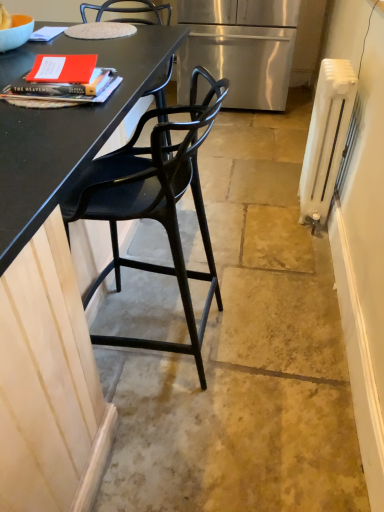
What is the approximate width of white painted metal radiator at right?

6.38 inches.

The width and height of the screenshot is (384, 512). Find the location of `stainless steel refrigerator at center`. stainless steel refrigerator at center is located at coordinates (240, 49).

Considering the positions of objects white painted metal radiator at right and stainless steel refrigerator at center in the image provided, who is behind, white painted metal radiator at right or stainless steel refrigerator at center?

stainless steel refrigerator at center is further from the camera.

In terms of size, does white painted metal radiator at right appear bigger or smaller than stainless steel refrigerator at center?

In the image, white painted metal radiator at right appears to be smaller than stainless steel refrigerator at center.

Is white painted metal radiator at right oriented towards stainless steel refrigerator at center?

No, white painted metal radiator at right is not aimed at stainless steel refrigerator at center.

Which is more to the right, black matte chair at left or stainless steel refrigerator at center?

stainless steel refrigerator at center.

Which of these two, black matte chair at left or stainless steel refrigerator at center, is smaller?

black matte chair at left is smaller.

From the image's perspective, which one is positioned higher, black matte chair at left or stainless steel refrigerator at center?

stainless steel refrigerator at center.

The height and width of the screenshot is (512, 384). I want to click on refrigerator directly beneath the black matte chair at left (from a real-world perspective), so pyautogui.click(x=240, y=49).

Which of these two, stainless steel refrigerator at center or white painted metal radiator at right, is wider?

stainless steel refrigerator at center is wider.

Who is taller, stainless steel refrigerator at center or white painted metal radiator at right?

stainless steel refrigerator at center is taller.

Based on the photo, is stainless steel refrigerator at center located outside white painted metal radiator at right?

Yes, stainless steel refrigerator at center is located beyond the bounds of white painted metal radiator at right.

Is the surface of black matte chair at left in direct contact with white painted metal radiator at right?

They are not placed beside each other.

Considering the relative sizes of black matte chair at left and white painted metal radiator at right in the image provided, is black matte chair at left wider than white painted metal radiator at right?

Indeed, black matte chair at left has a greater width compared to white painted metal radiator at right.

Can you confirm if black matte chair at left is bigger than white painted metal radiator at right?

Correct, black matte chair at left is larger in size than white painted metal radiator at right.

Looking at this image, from the image's perspective, is black matte chair at left below white painted metal radiator at right?

Indeed, from the image's perspective, black matte chair at left is shown beneath white painted metal radiator at right.

Find the location of a particular element. Image resolution: width=384 pixels, height=512 pixels. radiator lying behind the black matte chair at left is located at coordinates (x=326, y=136).

In the scene shown: Who is shorter, white painted metal radiator at right or black matte chair at left?

Standing shorter between the two is white painted metal radiator at right.

Is point (308, 165) behind point (206, 133)?

Yes, it is.

Looking at this image, considering the sizes of objects white painted metal radiator at right and black matte chair at left in the image provided, who is wider, white painted metal radiator at right or black matte chair at left?

black matte chair at left is wider.

Looking at this image, considering the relative positions of stainless steel refrigerator at center and black matte chair at left in the image provided, is stainless steel refrigerator at center to the right of black matte chair at left from the viewer's perspective?

Indeed, stainless steel refrigerator at center is positioned on the right side of black matte chair at left.

Considering the sizes of stainless steel refrigerator at center and black matte chair at left in the image, is stainless steel refrigerator at center taller or shorter than black matte chair at left?

Considering their sizes, stainless steel refrigerator at center has less height than black matte chair at left.

From a real-world perspective, is stainless steel refrigerator at center physically below black matte chair at left?

Yes.

Can you see stainless steel refrigerator at center touching black matte chair at left?

No, stainless steel refrigerator at center is not next to black matte chair at left.

Image resolution: width=384 pixels, height=512 pixels. What are the coordinates of `radiator that appears below the stainless steel refrigerator at center (from a real-world perspective)` in the screenshot? It's located at (326, 136).

The height and width of the screenshot is (512, 384). Find the location of `chair below the stainless steel refrigerator at center (from the image's perspective)`. chair below the stainless steel refrigerator at center (from the image's perspective) is located at coordinates click(155, 205).

Considering their positions, is white painted metal radiator at right positioned further to black matte chair at left than stainless steel refrigerator at center?

Among the two, stainless steel refrigerator at center is located further to black matte chair at left.

Looking at the image, which one is located closer to stainless steel refrigerator at center, black matte chair at left or white painted metal radiator at right?

white painted metal radiator at right lies closer to stainless steel refrigerator at center than the other object.

Estimate the real-world distances between objects in this image. Which object is closer to stainless steel refrigerator at center, white painted metal radiator at right or black matte chair at left?

white painted metal radiator at right.

Estimate the real-world distances between objects in this image. Which object is closer to white painted metal radiator at right, stainless steel refrigerator at center or black matte chair at left?

Among the two, black matte chair at left is located nearer to white painted metal radiator at right.

Which object lies nearer to the anchor point white painted metal radiator at right, black matte chair at left or stainless steel refrigerator at center?

Based on the image, black matte chair at left appears to be nearer to white painted metal radiator at right.

From the picture: Based on their spatial positions, is stainless steel refrigerator at center or white painted metal radiator at right further from black matte chair at left?

Among the two, stainless steel refrigerator at center is located further to black matte chair at left.

The width and height of the screenshot is (384, 512). I want to click on radiator located between black matte chair at left and stainless steel refrigerator at center in the depth direction, so (326, 136).